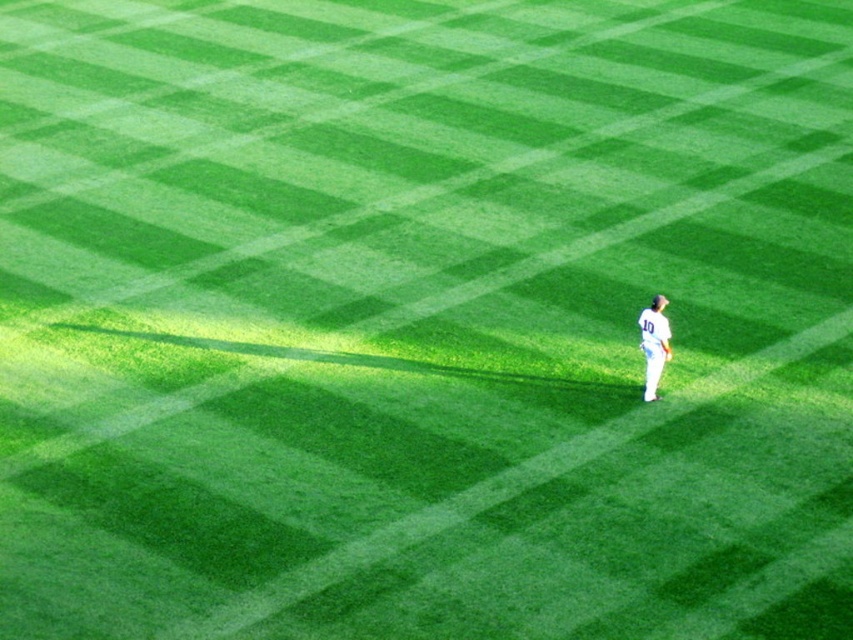
Does white jersey at right appear under white fabric baseball glove at center-right?

No, white jersey at right is not below white fabric baseball glove at center-right.

Which is above, white jersey at right or white fabric baseball glove at center-right?

Positioned higher is white jersey at right.

The image size is (853, 640). Describe the element at coordinates (653, 342) in the screenshot. I see `white jersey at right` at that location.

I want to click on white jersey at right, so click(x=653, y=342).